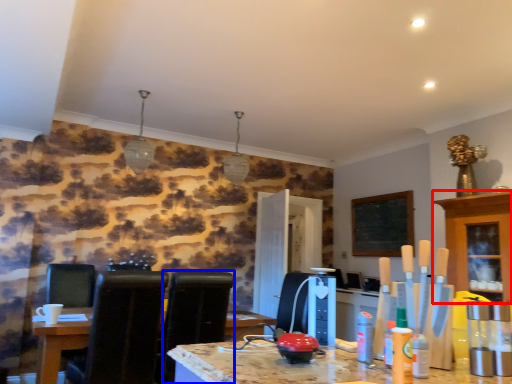
Question: Which object appears farthest to the camera in this image, cabinetry (highlighted by a red box) or chair (highlighted by a blue box)?

Choices:
 (A) cabinetry
 (B) chair

Answer: (A)